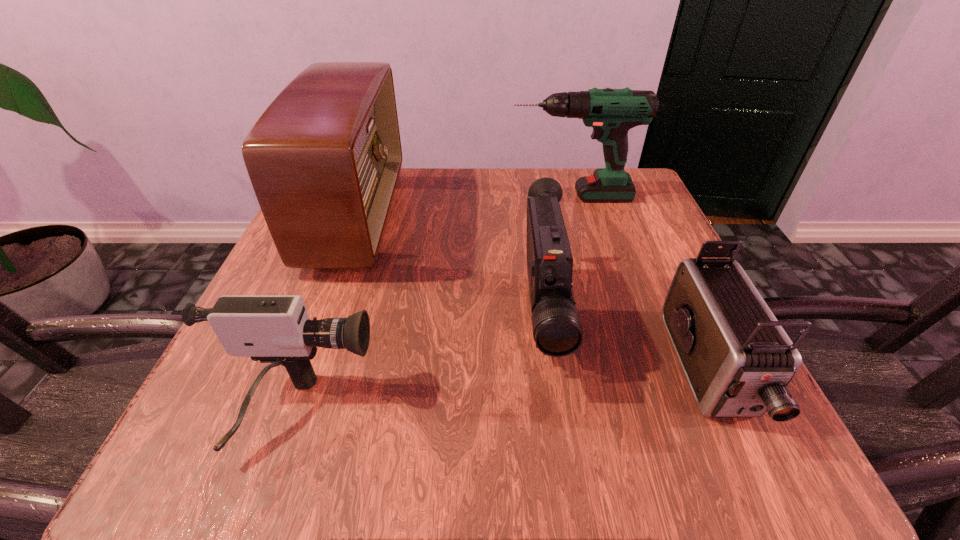
The image size is (960, 540). I want to click on vacant space located 0.170m on the recording direction of the leftmost camcorder, so click(497, 413).

This screenshot has height=540, width=960. What are the coordinates of `radio receiver located at the far edge` in the screenshot? It's located at (324, 159).

Where is `drill that is positioned at the far edge`? The width and height of the screenshot is (960, 540). drill that is positioned at the far edge is located at coordinates (612, 113).

Locate an element on the screen. The image size is (960, 540). radio receiver that is at the left edge is located at coordinates (324, 159).

Locate an element on the screen. The image size is (960, 540). camcorder present at the left edge is located at coordinates (276, 329).

Identify the location of drill located in the right edge section of the desktop. click(x=612, y=113).

Find the location of a particular element. camcorder located in the right edge section of the desktop is located at coordinates (738, 360).

At what (x,y) coordinates should I click in order to perform the action: click on object at the far left corner. Please return your answer as a coordinate pair (x, y). This screenshot has height=540, width=960. Looking at the image, I should click on (324, 159).

In order to click on object present at the near left corner in this screenshot , I will do `click(276, 329)`.

Find the location of a particular element. The height and width of the screenshot is (540, 960). object located at the far right corner is located at coordinates (612, 113).